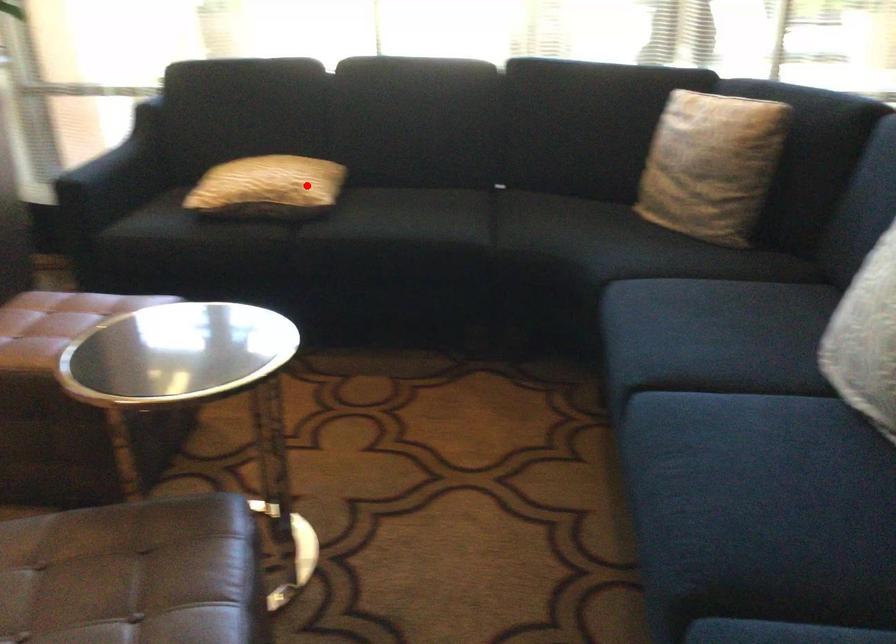
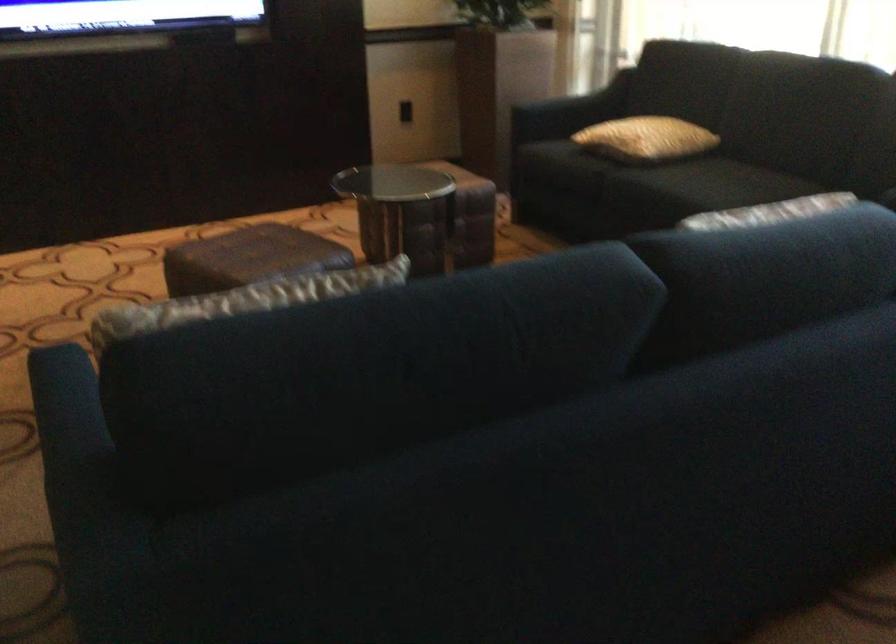
Question: A red point is marked in image1. In image2, is the corresponding 3D point closer to the camera or farther? Reply with the corresponding letter.

Choices:
 (A) The corresponding 3D point is closer.
 (B) The corresponding 3D point is farther.

Answer: (B)